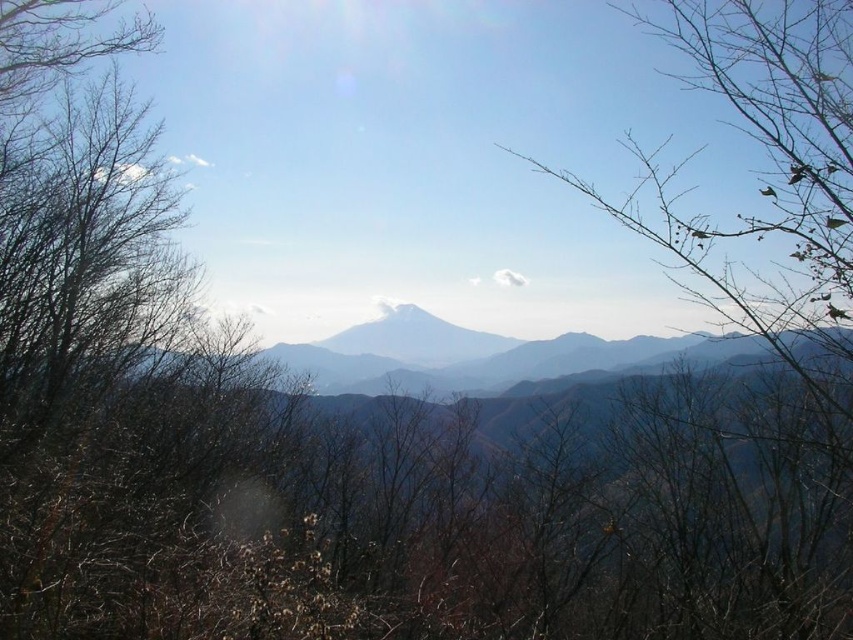
Based on the scene description, where is the gray foggy mountain range at center located in the image?

The gray foggy mountain range at center is located at point (477, 355).

You are standing in the mountain landscape and want to walk from the point closer to you to the distant point. Which path would you take between the two points, point (204,504) and point (363,333)?

You should take the path from point (204,504) to point (363,333) because point (204,504) is closer to the viewer, so it is the starting point, and the other point is further away.